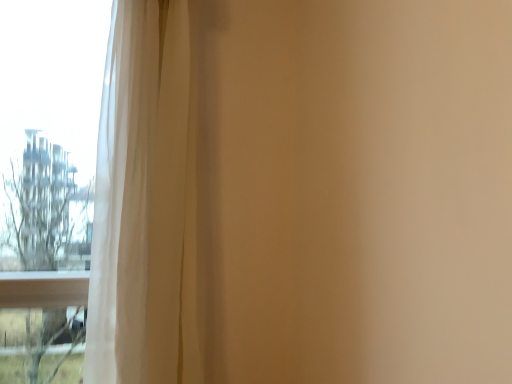
Where is `transparent glass window at left`? This screenshot has height=384, width=512. transparent glass window at left is located at coordinates (49, 197).

What do you see at coordinates (49, 197) in the screenshot? The image size is (512, 384). I see `transparent glass window at left` at bounding box center [49, 197].

From the picture: Measure the distance between transparent glass window at left and camera.

The depth of transparent glass window at left is 3.21 meters.

Where is `white sheer curtain at left`? Image resolution: width=512 pixels, height=384 pixels. white sheer curtain at left is located at coordinates (140, 197).

This screenshot has height=384, width=512. What do you see at coordinates (140, 197) in the screenshot? I see `white sheer curtain at left` at bounding box center [140, 197].

Find the location of a particular element. Image resolution: width=512 pixels, height=384 pixels. transparent glass window at left is located at coordinates (49, 197).

Can you confirm if transparent glass window at left is positioned to the right of white sheer curtain at left?

In fact, transparent glass window at left is to the left of white sheer curtain at left.

Which is in front, transparent glass window at left or white sheer curtain at left?

white sheer curtain at left is in front.

Which is in front, point (88, 161) or point (155, 371)?

The point (155, 371) is in front.

From the image's perspective, does transparent glass window at left appear lower than white sheer curtain at left?

No, from the image's perspective, transparent glass window at left is not below white sheer curtain at left.

From a real-world perspective, does transparent glass window at left sit lower than white sheer curtain at left?

No, from a real-world perspective, transparent glass window at left is not below white sheer curtain at left.

Which of these two, transparent glass window at left or white sheer curtain at left, is wider?

transparent glass window at left is wider.

In terms of height, does transparent glass window at left look taller or shorter compared to white sheer curtain at left?

In the image, transparent glass window at left appears to be taller than white sheer curtain at left.

In terms of size, does transparent glass window at left appear bigger or smaller than white sheer curtain at left?

Considering their sizes, transparent glass window at left takes up less space than white sheer curtain at left.

Is transparent glass window at left surrounding white sheer curtain at left?

No, transparent glass window at left does not contain white sheer curtain at left.

Is transparent glass window at left positioned far away from white sheer curtain at left?

A: That's right, there is a large distance between transparent glass window at left and white sheer curtain at left.

Is white sheer curtain at left at the back of transparent glass window at left?

No, transparent glass window at left is not facing the opposite direction of white sheer curtain at left.

How many degrees apart are the facing directions of transparent glass window at left and white sheer curtain at left?

0.581 degrees separate the facing orientations of transparent glass window at left and white sheer curtain at left.

How far apart are transparent glass window at left and white sheer curtain at left?

2.58 meters.

Identify the location of window located above the white sheer curtain at left (from a real-world perspective). (49, 197).

Visually, is white sheer curtain at left positioned to the left or to the right of transparent glass window at left?

white sheer curtain at left is positioned on transparent glass window at left's right side.

Who is more distant, white sheer curtain at left or transparent glass window at left?

transparent glass window at left is further from the camera.

Which is less distant, (112, 15) or (64, 213)?

The point (112, 15) is more forward.

Looking at this image, from the image's perspective, is white sheer curtain at left over transparent glass window at left?

Incorrect, from the image's perspective, white sheer curtain at left is lower than transparent glass window at left.

Looking at this image, from a real-world perspective, is white sheer curtain at left under transparent glass window at left?

Indeed, from a real-world perspective, white sheer curtain at left is positioned beneath transparent glass window at left.

Which of these two, white sheer curtain at left or transparent glass window at left, is thinner?

Thinner between the two is white sheer curtain at left.

Considering the relative sizes of white sheer curtain at left and transparent glass window at left in the image provided, is white sheer curtain at left taller than transparent glass window at left?

No, white sheer curtain at left is not taller than transparent glass window at left.

Can you confirm if white sheer curtain at left is bigger than transparent glass window at left?

Yes, white sheer curtain at left is bigger than transparent glass window at left.

Would you say white sheer curtain at left is inside or outside transparent glass window at left?

The correct answer is: outside.

In the scene shown: Is the surface of white sheer curtain at left in direct contact with transparent glass window at left?

No, white sheer curtain at left is not next to transparent glass window at left.

Is white sheer curtain at left aimed at transparent glass window at left?

No, white sheer curtain at left does not turn towards transparent glass window at left.

Locate an element on the screen. The height and width of the screenshot is (384, 512). curtain in front of the transparent glass window at left is located at coordinates (140, 197).

Find the location of `curtain on the right of transparent glass window at left`. curtain on the right of transparent glass window at left is located at coordinates pyautogui.click(x=140, y=197).

Locate an element on the screen. curtain that appears in front of the transparent glass window at left is located at coordinates (140, 197).